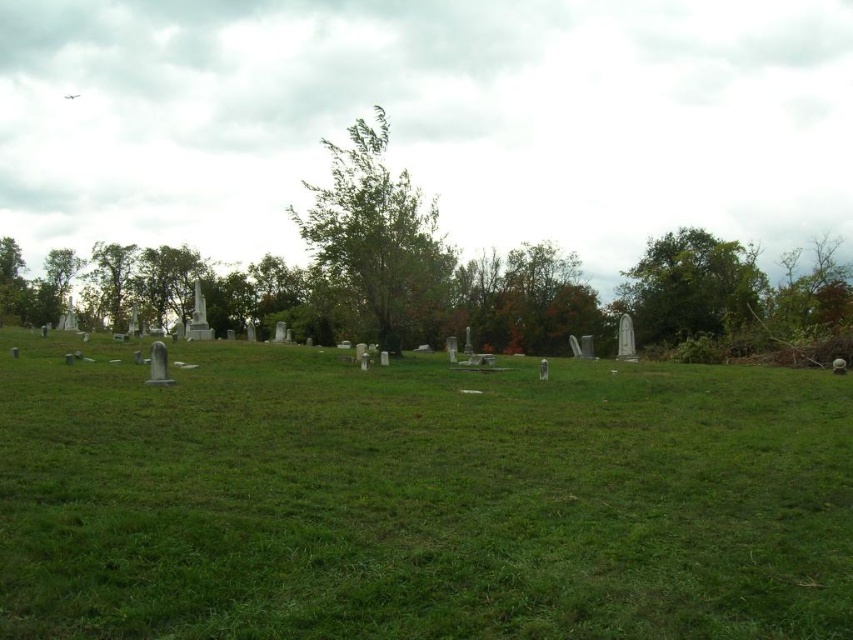
Question: Estimate the real-world distances between objects in this image. Which object is closer to the green leafy tree at left?

Choices:
 (A) green leafy tree at center
 (B) green leafy tree at upper right
 (C) green grassy field at center

Answer: (A)

Question: Based on their relative distances, which object is farther from the green leafy tree at center?

Choices:
 (A) green grassy field at center
 (B) green leafy tree at upper right
 (C) green leafy tree at left

Answer: (C)

Question: Is the position of green grassy field at center less distant than that of green leafy tree at upper right?

Choices:
 (A) yes
 (B) no

Answer: (A)

Question: Does green leafy tree at center come in front of green leafy tree at left?

Choices:
 (A) yes
 (B) no

Answer: (A)

Question: Can you confirm if green leafy tree at center is positioned to the left of green leafy tree at upper right?

Choices:
 (A) no
 (B) yes

Answer: (B)

Question: Based on their relative distances, which object is farther from the green leafy tree at left?

Choices:
 (A) green leafy tree at center
 (B) green grassy field at center

Answer: (B)